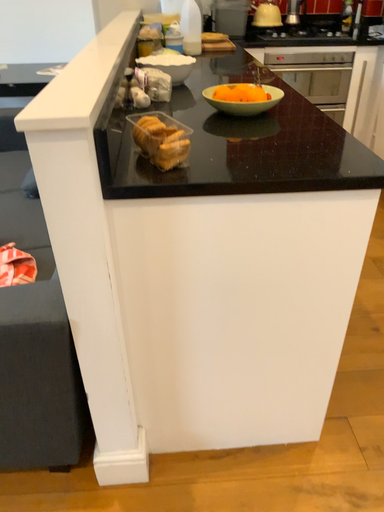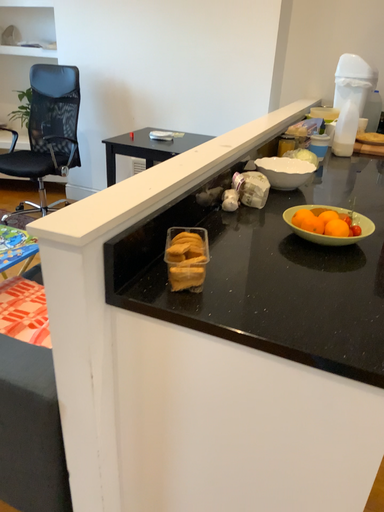
Question: Which way did the camera rotate in the video?

Choices:
 (A) rotated upward
 (B) rotated downward

Answer: (A)